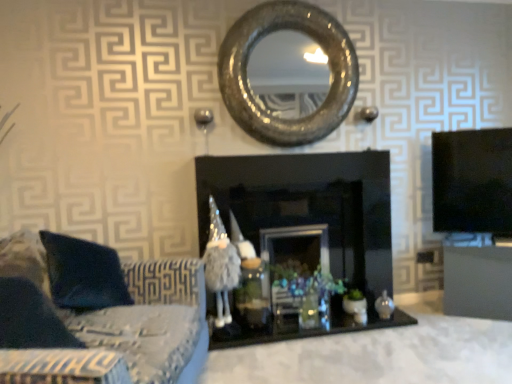
The width and height of the screenshot is (512, 384). Describe the element at coordinates (153, 322) in the screenshot. I see `suede-like fabric couch at lower left` at that location.

Find the location of a particular element. black glossy fireplace at center is located at coordinates (307, 223).

Describe the element at coordinates (478, 282) in the screenshot. The width and height of the screenshot is (512, 384). I see `matte black cabinet at right` at that location.

From the picture: What is the approximate height of fuzzy fabric wizard at center?

fuzzy fabric wizard at center is 33.74 inches tall.

This screenshot has width=512, height=384. I want to click on shiny metallic mirror at center, so click(x=246, y=72).

Where is `suede-like fabric couch at lower left`? This screenshot has width=512, height=384. suede-like fabric couch at lower left is located at coordinates (153, 322).

From a real-world perspective, does fuzzy fabric wizard at center stand above black glossy fireplace at center?

No, from a real-world perspective, fuzzy fabric wizard at center is not above black glossy fireplace at center.

Between fuzzy fabric wizard at center and black glossy fireplace at center, which one has larger size?

With larger size is black glossy fireplace at center.

Does fuzzy fabric wizard at center turn towards black glossy fireplace at center?

Yes, fuzzy fabric wizard at center is facing black glossy fireplace at center.

Between fuzzy fabric wizard at center and black glossy fireplace at center, which one has more height?

black glossy fireplace at center.

From a real-world perspective, is black glossy fireplace at center above or below shiny metallic mirror at center?

black glossy fireplace at center is below shiny metallic mirror at center.

Is black glossy fireplace at center situated inside shiny metallic mirror at center or outside?

black glossy fireplace at center is not enclosed by shiny metallic mirror at center.

Considering the relative sizes of black glossy fireplace at center and shiny metallic mirror at center in the image provided, is black glossy fireplace at center wider than shiny metallic mirror at center?

Yes, black glossy fireplace at center is wider than shiny metallic mirror at center.

Considering the relative sizes of black glossy fireplace at center and shiny metallic mirror at center in the image provided, is black glossy fireplace at center shorter than shiny metallic mirror at center?

In fact, black glossy fireplace at center may be taller than shiny metallic mirror at center.

Considering their positions, is shiny metallic mirror at center located in front of or behind suede-like fabric couch at lower left?

In the image, shiny metallic mirror at center appears behind suede-like fabric couch at lower left.

Where is `studio couch that is below the shiny metallic mirror at center (from the image's perspective)`? This screenshot has height=384, width=512. studio couch that is below the shiny metallic mirror at center (from the image's perspective) is located at coordinates (153, 322).

Is shiny metallic mirror at center bigger than suede-like fabric couch at lower left?

Incorrect, shiny metallic mirror at center is not larger than suede-like fabric couch at lower left.

Is shiny metallic mirror at center to the left or to the right of suede-like fabric couch at lower left in the image?

Based on their positions, shiny metallic mirror at center is located to the right of suede-like fabric couch at lower left.

Between suede-like fabric couch at lower left and fuzzy fabric wizard at center, which one has smaller size?

Smaller between the two is fuzzy fabric wizard at center.

Which object is positioned more to the left, suede-like fabric couch at lower left or fuzzy fabric wizard at center?

Positioned to the left is suede-like fabric couch at lower left.

Does suede-like fabric couch at lower left have a greater height compared to fuzzy fabric wizard at center?

In fact, suede-like fabric couch at lower left may be shorter than fuzzy fabric wizard at center.

Relative to black glossy fireplace at center, is matte black cabinet at right in front or behind?

matte black cabinet at right is positioned farther from the viewer than black glossy fireplace at center.

Is matte black cabinet at right positioned beyond the bounds of black glossy fireplace at center?

Yes, matte black cabinet at right is outside of black glossy fireplace at center.

Which object is thinner, matte black cabinet at right or black glossy fireplace at center?

matte black cabinet at right.

Which is farther, (448, 247) or (200, 301)?

The point (448, 247) is farther from the camera.

From a real-world perspective, which object stands above the other?

suede-like fabric couch at lower left is physically above.

Which of these two, matte black cabinet at right or suede-like fabric couch at lower left, stands taller?

suede-like fabric couch at lower left.

Does matte black cabinet at right appear on the right side of suede-like fabric couch at lower left?

Yes, matte black cabinet at right is to the right of suede-like fabric couch at lower left.

Is black glossy fireplace at center shorter than suede-like fabric couch at lower left?

No, black glossy fireplace at center is not shorter than suede-like fabric couch at lower left.

Looking at this image, can you see black glossy fireplace at center touching suede-like fabric couch at lower left?

They are not placed beside each other.

From the image's perspective, relative to suede-like fabric couch at lower left, is black glossy fireplace at center above or below?

Clearly, from the image's perspective, black glossy fireplace at center is above suede-like fabric couch at lower left.

Find the location of a particular element. The height and width of the screenshot is (384, 512). toy behind the black glossy fireplace at center is located at coordinates (220, 265).

You are a GUI agent. You are given a task and a screenshot of the screen. Output one action in this format:
    pyautogui.click(x=<x>, y=<y>)
    Task: Click on the fireplace beneath the shiny metallic mirror at center (from a real-world perspective)
    
    Given the screenshot: What is the action you would take?
    pyautogui.click(x=307, y=223)

Estimate the real-world distances between objects in this image. Which object is further from shiny metallic mirror at center, black glossy fireplace at center or fuzzy fabric wizard at center?

fuzzy fabric wizard at center lies further to shiny metallic mirror at center than the other object.

Looking at the image, which one is located closer to black glossy fireplace at center, suede-like fabric couch at lower left or matte black cabinet at right?

Among the two, matte black cabinet at right is located nearer to black glossy fireplace at center.

Which object lies further to the anchor point shiny metallic mirror at center, matte black cabinet at right or black glossy fireplace at center?

Among the two, matte black cabinet at right is located further to shiny metallic mirror at center.

Considering their positions, is suede-like fabric couch at lower left positioned further to shiny metallic mirror at center than matte black cabinet at right?

Among the two, matte black cabinet at right is located further to shiny metallic mirror at center.

When comparing their distances from shiny metallic mirror at center, does fuzzy fabric wizard at center or suede-like fabric couch at lower left seem further?

suede-like fabric couch at lower left.

Which object lies further to the anchor point fuzzy fabric wizard at center, matte black cabinet at right or black glossy fireplace at center?

matte black cabinet at right is further to fuzzy fabric wizard at center.

Considering their positions, is black glossy fireplace at center positioned further to matte black cabinet at right than shiny metallic mirror at center?

The object further to matte black cabinet at right is shiny metallic mirror at center.

From the image, which object appears to be nearer to black glossy fireplace at center, fuzzy fabric wizard at center or suede-like fabric couch at lower left?

Among the two, fuzzy fabric wizard at center is located nearer to black glossy fireplace at center.

What are the coordinates of `oval between fuzzy fabric wizard at center and matte black cabinet at right in the horizontal direction` in the screenshot? It's located at (246, 72).

Image resolution: width=512 pixels, height=384 pixels. Find the location of `toy located between suede-like fabric couch at lower left and matte black cabinet at right in the left-right direction`. toy located between suede-like fabric couch at lower left and matte black cabinet at right in the left-right direction is located at coordinates (220, 265).

Where is `toy between suede-like fabric couch at lower left and shiny metallic mirror at center from front to back`? The height and width of the screenshot is (384, 512). toy between suede-like fabric couch at lower left and shiny metallic mirror at center from front to back is located at coordinates (220, 265).

The height and width of the screenshot is (384, 512). I want to click on fireplace between shiny metallic mirror at center and fuzzy fabric wizard at center in the up-down direction, so click(307, 223).